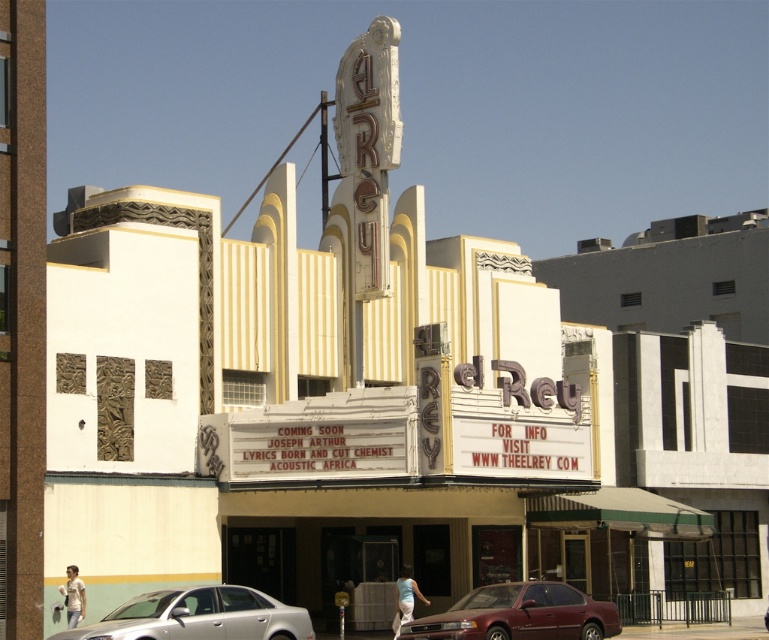
Question: Can you confirm if maroon metallic sedan at lower center is positioned to the left of white cotton shirt at lower center?

Choices:
 (A) no
 (B) yes

Answer: (A)

Question: Estimate the real-world distances between objects in this image. Which object is closer to the maroon metallic sedan at lower center?

Choices:
 (A) light beige t-shirt at lower left
 (B) silver metallic sedan at lower center

Answer: (B)

Question: Which object is farther from the camera taking this photo?

Choices:
 (A) white cotton shirt at lower center
 (B) light beige t-shirt at lower left
 (C) maroon metallic sedan at lower center
 (D) silver metallic sedan at lower center

Answer: (A)

Question: Does maroon metallic sedan at lower center have a larger size compared to light beige t-shirt at lower left?

Choices:
 (A) no
 (B) yes

Answer: (B)

Question: Is maroon metallic sedan at lower center wider than light beige t-shirt at lower left?

Choices:
 (A) yes
 (B) no

Answer: (A)

Question: Which of the following is the farthest from the observer?

Choices:
 (A) silver metallic sedan at lower center
 (B) maroon metallic sedan at lower center
 (C) white cotton shirt at lower center
 (D) light beige t-shirt at lower left

Answer: (C)